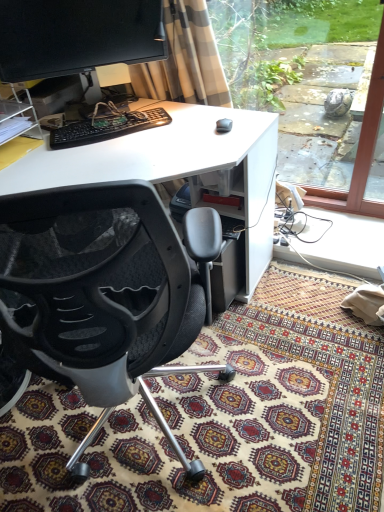
Where is `free spot above black plastic keyboard at center (from a real-world perspective)`? free spot above black plastic keyboard at center (from a real-world perspective) is located at coordinates (108, 121).